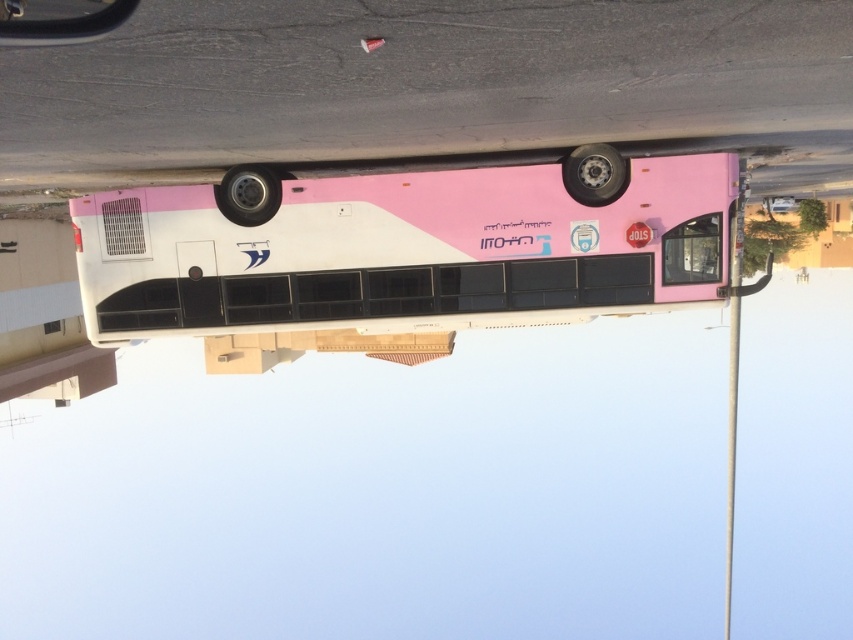
From the picture: Measure the distance from pink matte bus at center to metallic black view mirror at upper left.

pink matte bus at center and metallic black view mirror at upper left are 11.78 meters apart from each other.

Who is more forward, (328, 241) or (44, 8)?

Point (44, 8)

Identify the location of pink matte bus at center. (403, 250).